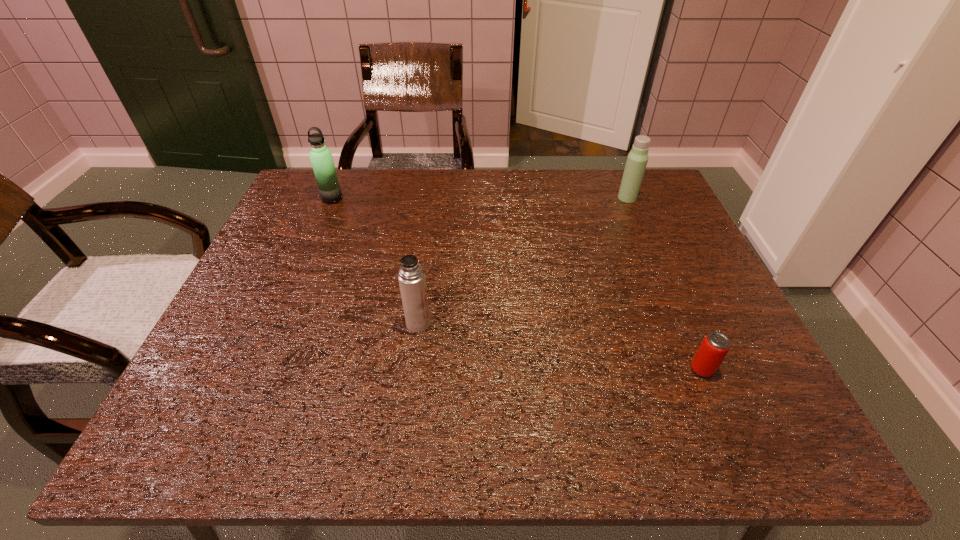
The image size is (960, 540). In order to click on octopus in this screenshot , I will do `click(637, 159)`.

You are a GUI agent. You are given a task and a screenshot of the screen. Output one action in this format:
    pyautogui.click(x=<x>, y=<y>)
    Task: Click on the bottle
    Image resolution: width=960 pixels, height=540 pixels.
    Given the screenshot: What is the action you would take?
    pyautogui.click(x=411, y=276)

Identify the location of duckling. (321, 158).

Image resolution: width=960 pixels, height=540 pixels. In order to click on the farthest object in this screenshot , I will do `click(321, 158)`.

You are a GUI agent. You are given a task and a screenshot of the screen. Output one action in this format:
    pyautogui.click(x=<x>, y=<y>)
    Task: Click on the tallest object
    
    Given the screenshot: What is the action you would take?
    pyautogui.click(x=709, y=356)

Locate an element on the screen. The height and width of the screenshot is (540, 960). the second farthest object is located at coordinates (709, 356).

The width and height of the screenshot is (960, 540). What are the coordinates of `blank space located 0.160m on the front-facing side of the octopus` in the screenshot? It's located at (229, 312).

Identify the location of free space located on the front-facing side of the octopus. (248, 312).

Identify the location of vacant space located on the back of the bottle. (626, 192).

This screenshot has width=960, height=540. In order to click on vacant space located on the face of the duckling in this screenshot , I will do `click(527, 200)`.